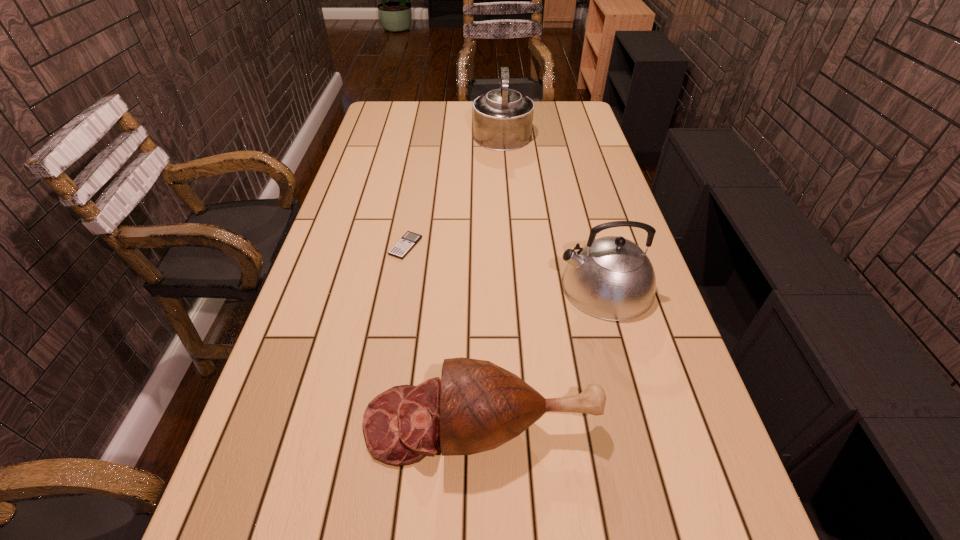
The image size is (960, 540). I want to click on vacant area that lies between the nearer kettle and the ham, so click(x=543, y=355).

This screenshot has height=540, width=960. Identify the location of vacant area that lies between the second shortest object and the shorter kettle. (543, 355).

Identify which object is located as the third nearest to the shortest object. Please provide its 2D coordinates. Your answer should be formatted as a tuple, i.e. [(x, y)], where the tuple contains the x and y coordinates of a point satisfying the conditions above.

[(502, 118)]

Where is `the closest object relative to the nearest object`? The image size is (960, 540). the closest object relative to the nearest object is located at coordinates coord(611,278).